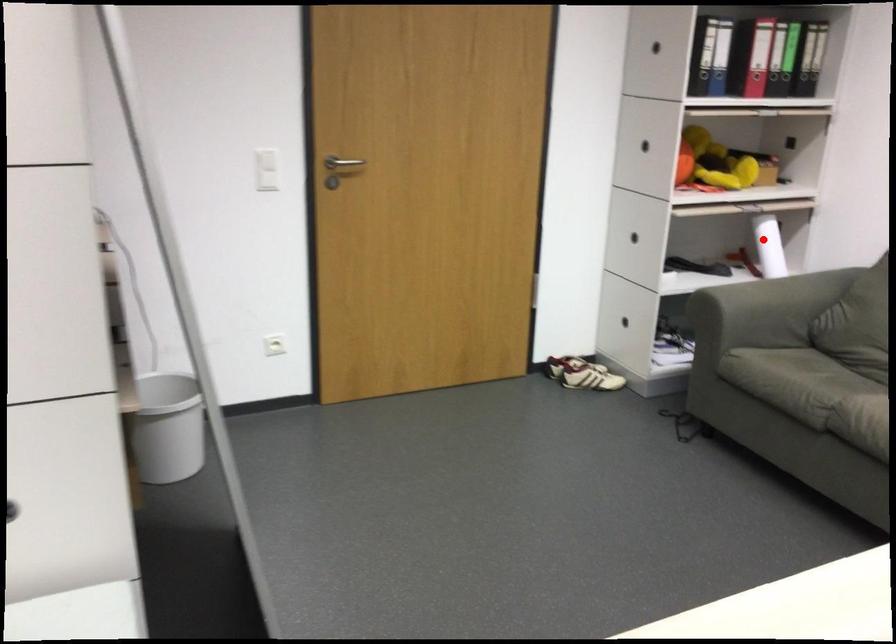
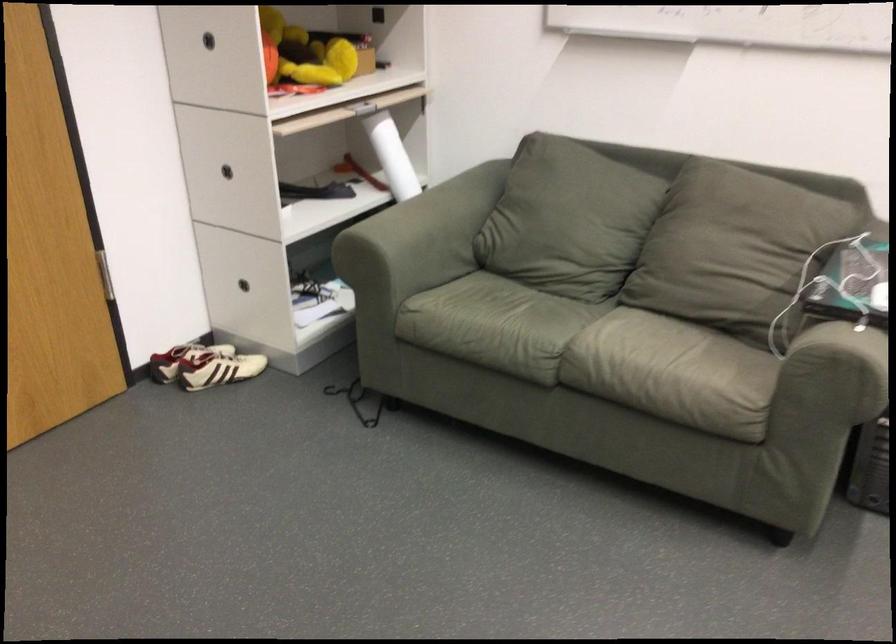
Find the pixel in the second image that matches the highlighted location in the first image.

(392, 156)